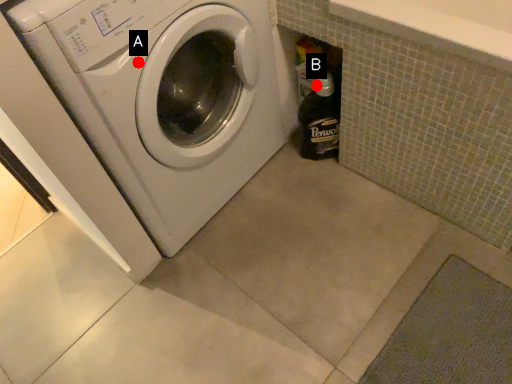
Question: Two points are circled on the image, labeled by A and B beside each circle. Which point is farther from the camera taking this photo?

Choices:
 (A) A is further
 (B) B is further

Answer: (B)